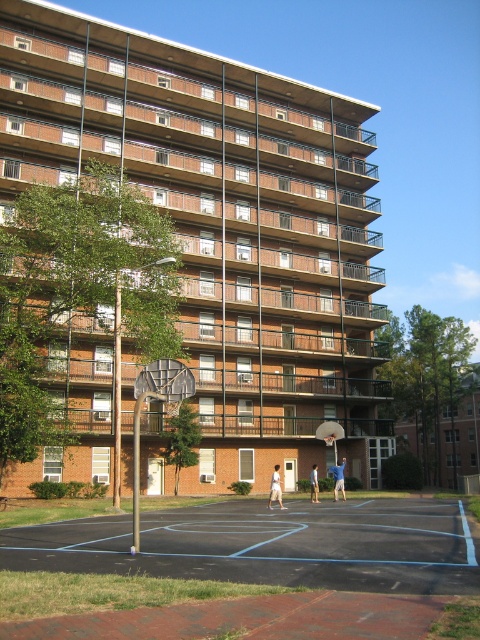
Can you confirm if black asphalt basketball court at center is smaller than light brown shorts at center?

No, black asphalt basketball court at center is not smaller than light brown shorts at center.

Does black asphalt basketball court at center appear over light brown shorts at center?

Yes.

Is point (145, 544) farther from camera compared to point (313, 497)?

No, it is in front of (313, 497).

Locate an element on the screen. This screenshot has width=480, height=640. black asphalt basketball court at center is located at coordinates (269, 545).

Between light beige shorts at center and light brown shorts at center, which one appears on the right side from the viewer's perspective?

light brown shorts at center is more to the right.

Which of these two, light beige shorts at center or light brown shorts at center, stands shorter?

light brown shorts at center

This screenshot has width=480, height=640. I want to click on light beige shorts at center, so click(276, 488).

At what (x,y) coordinates should I click in order to perform the action: click on light beige shorts at center. Please return your answer as a coordinate pair (x, y). The height and width of the screenshot is (640, 480). Looking at the image, I should click on (276, 488).

Can you confirm if blue cotton shirt at center is thinner than light brown shorts at center?

No, blue cotton shirt at center is not thinner than light brown shorts at center.

Is blue cotton shirt at center closer to camera compared to light brown shorts at center?

No, blue cotton shirt at center is further to the viewer.

Who is more distant from viewer, (339, 484) or (314, 496)?

Positioned behind is point (339, 484).

This screenshot has height=640, width=480. I want to click on blue cotton shirt at center, so click(x=338, y=480).